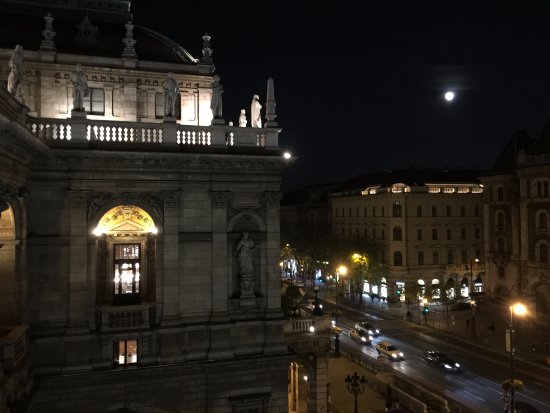
The height and width of the screenshot is (413, 550). In order to click on windows in this screenshot , I will do `click(123, 276)`, `click(126, 355)`.